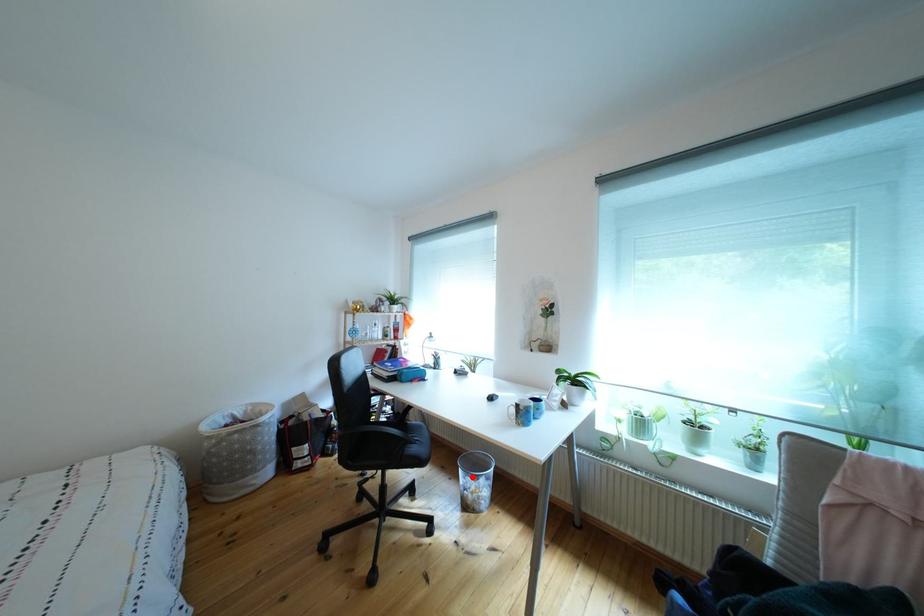
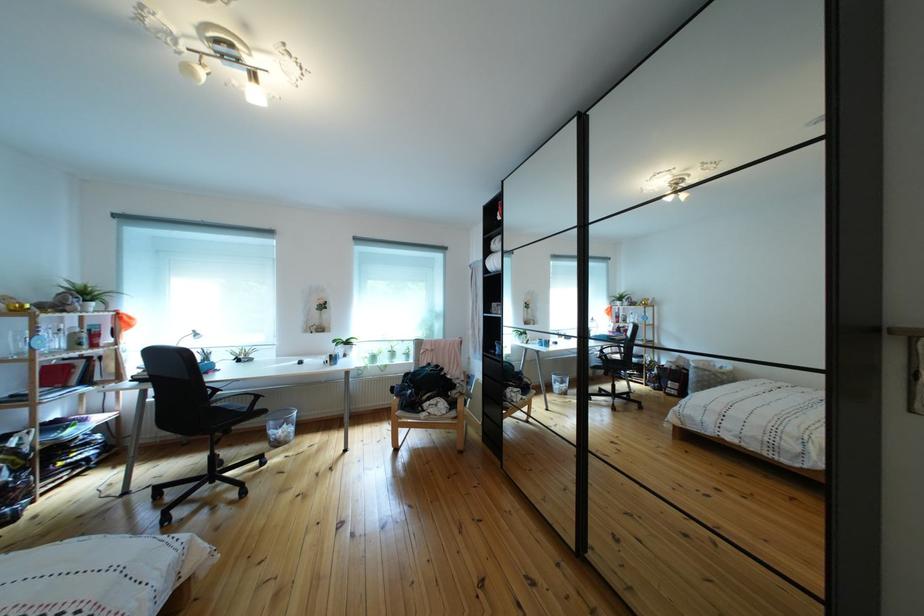
Find the pixel in the second image that matches the highlighted location in the first image.

(283, 430)